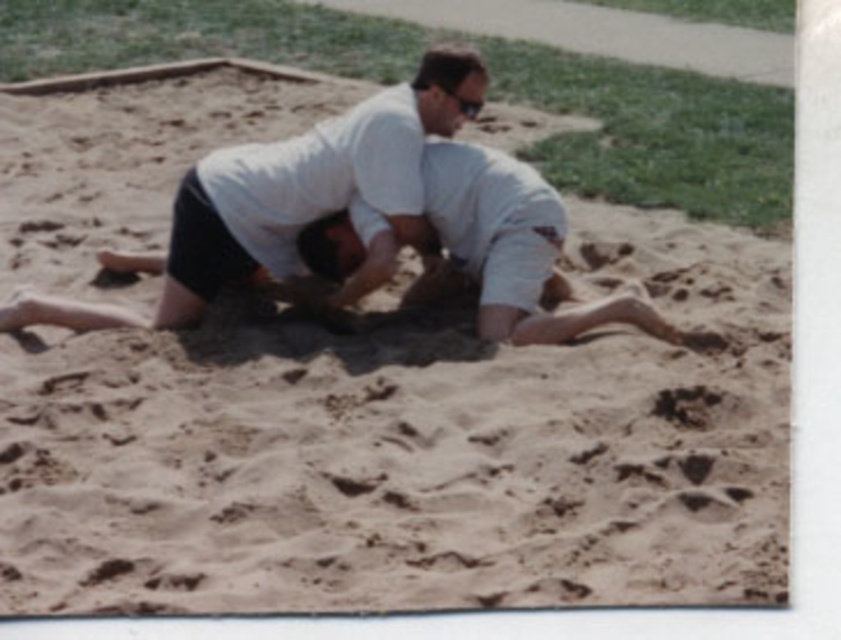
You are a photographer trying to capture the wrestling match. You want to focus on the white matte shirt at center. Where should you point your camera to ensure the point at coordinates [286,200] is in the frame?

The point at coordinates [286,200] is located on the white matte shirt at center, so you should point your camera towards the white matte shirt at center to include that specific point in the frame.

You are standing at the paved pathway in the background and want to walk towards the wrestling match. Which point, point [361,179] or point [563,275], would you reach first?

Point [361,179] is closer to the viewer than point [563,275], so you would reach point [361,179] first.